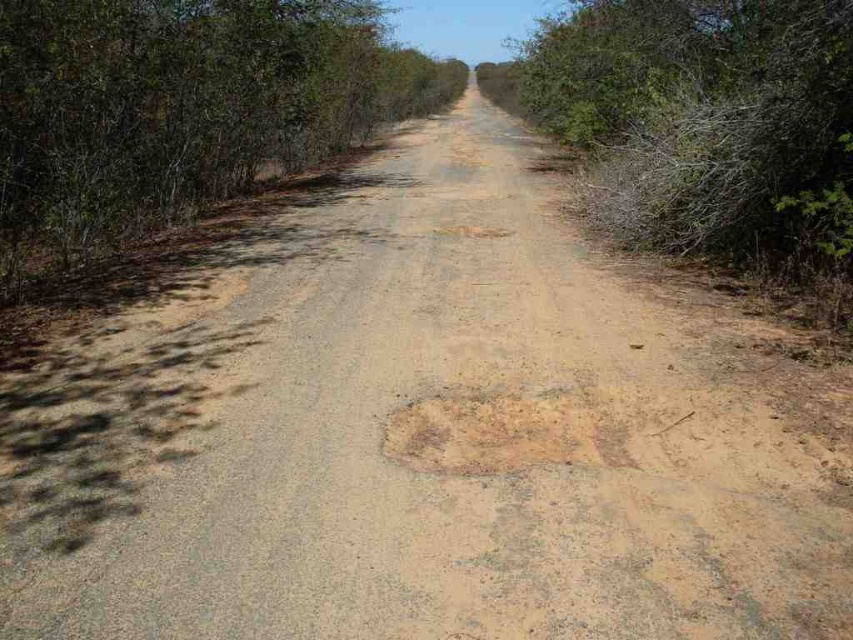
Does green leafy bush at left come in front of green leafy bush at right?

No, it is behind green leafy bush at right.

What are the coordinates of `green leafy bush at left` in the screenshot? It's located at (180, 109).

This screenshot has height=640, width=853. Find the location of `green leafy bush at left`. green leafy bush at left is located at coordinates (180, 109).

Who is lower down, green leafy bush at left or brown textured patch at center?

brown textured patch at center is below.

Can you confirm if green leafy bush at left is bigger than brown textured patch at center?

Correct, green leafy bush at left is larger in size than brown textured patch at center.

The image size is (853, 640). What are the coordinates of `green leafy bush at left` in the screenshot? It's located at (180, 109).

This screenshot has height=640, width=853. Identify the location of green leafy bush at right. pos(701,120).

Can you confirm if green leafy bush at right is positioned below brown textured patch at center?

Actually, green leafy bush at right is above brown textured patch at center.

Between point (674, 182) and point (627, 432), which one is positioned in front?

Point (627, 432)

This screenshot has height=640, width=853. I want to click on green leafy bush at right, so click(x=701, y=120).